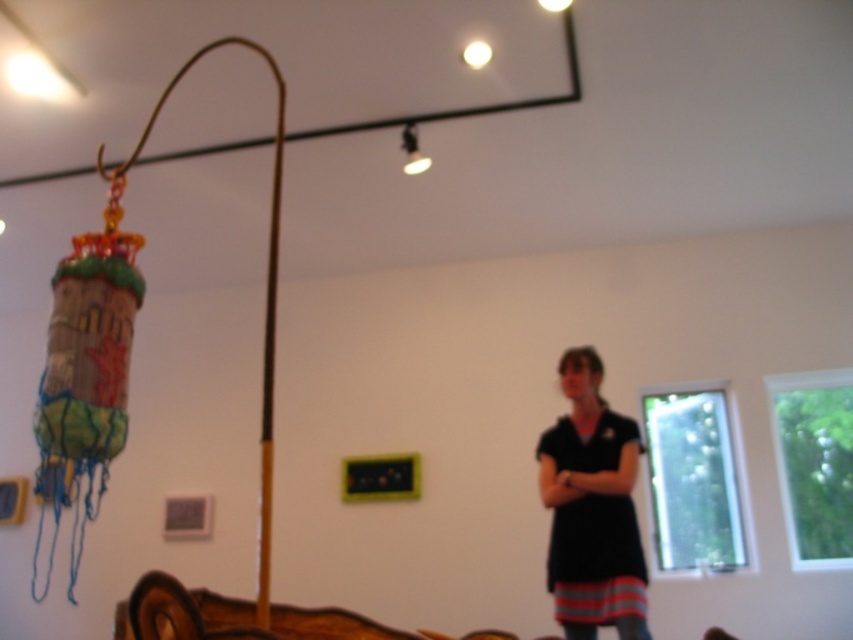
Which of these two, brown wood pole at center or matte black lamp at upper center, stands shorter?

matte black lamp at upper center

This screenshot has width=853, height=640. I want to click on brown wood pole at center, so click(270, 364).

Is point (589, 518) closer to viewer compared to point (302, 620)?

No, (589, 518) is behind (302, 620).

Is black matte dress at right bigger than brown wooden bed at lower left?

Correct, black matte dress at right is larger in size than brown wooden bed at lower left.

You are a GUI agent. You are given a task and a screenshot of the screen. Output one action in this format:
    pyautogui.click(x=<x>, y=<y>)
    Task: Click on the black matte dress at right
    The image size is (853, 640).
    Given the screenshot: What is the action you would take?
    pyautogui.click(x=592, y=508)

At what (x,y) coordinates should I click in order to perform the action: click on black matte dress at right. Please return your answer as a coordinate pair (x, y). Looking at the image, I should click on (592, 508).

Which is in front, point (152, 600) or point (408, 164)?

Point (152, 600) is more forward.

Can you confirm if brown wooden bed at lower left is thinner than matte black lamp at upper center?

No, brown wooden bed at lower left is not thinner than matte black lamp at upper center.

In the scene shown: Who is more distant from viewer, (212, 608) or (416, 148)?

The point (416, 148) is more distant.

Where is `brown wooden bed at lower left`? brown wooden bed at lower left is located at coordinates (244, 618).